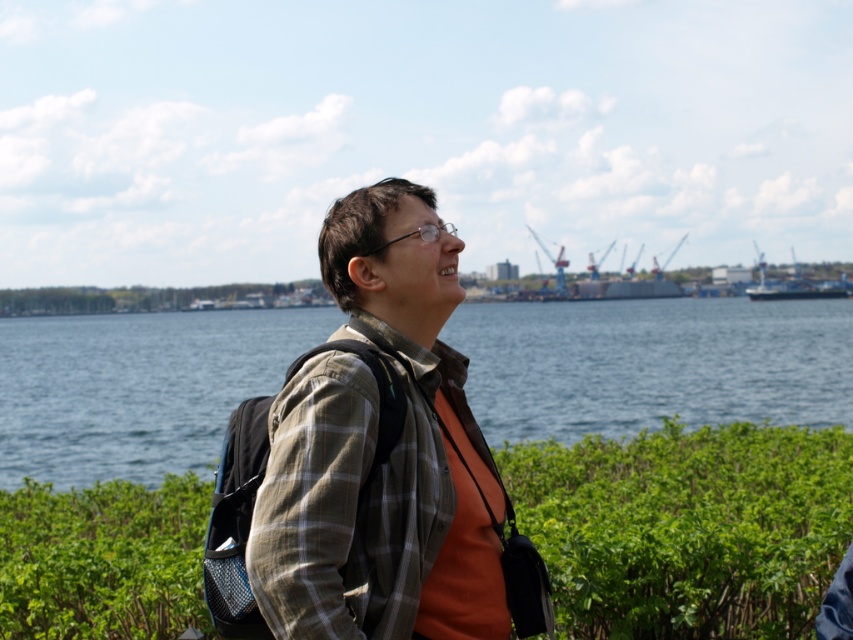
Can you confirm if blue water at center is positioned to the left of plaid fabric shirt at center?

Correct, you'll find blue water at center to the left of plaid fabric shirt at center.

Who is lower down, blue water at center or plaid fabric shirt at center?

plaid fabric shirt at center

Describe the element at coordinates (653, 364) in the screenshot. The height and width of the screenshot is (640, 853). I see `blue water at center` at that location.

Find the location of a particular element. The width and height of the screenshot is (853, 640). blue water at center is located at coordinates (653, 364).

Is green leafy shrubs at center in front of plaid fabric shirt at center?

No, it is not.

In the scene shown: Which is below, green leafy shrubs at center or plaid fabric shirt at center?

Positioned lower is green leafy shrubs at center.

Who is more distant from viewer, [779,504] or [444,244]?

The point [779,504] is more distant.

Image resolution: width=853 pixels, height=640 pixels. Find the location of `green leafy shrubs at center`. green leafy shrubs at center is located at coordinates (688, 528).

Can you confirm if plaid fabric shirt at center is positioned to the left of blue metallic ship at right?

Indeed, plaid fabric shirt at center is positioned on the left side of blue metallic ship at right.

This screenshot has height=640, width=853. What do you see at coordinates (373, 449) in the screenshot?
I see `plaid fabric shirt at center` at bounding box center [373, 449].

What do you see at coordinates (373, 449) in the screenshot? I see `plaid fabric shirt at center` at bounding box center [373, 449].

The height and width of the screenshot is (640, 853). I want to click on plaid fabric shirt at center, so click(373, 449).